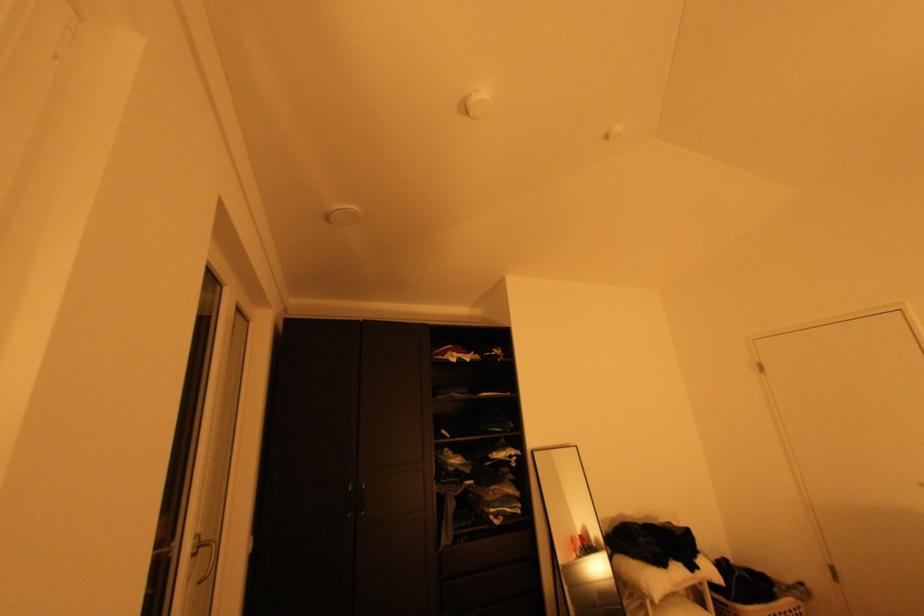
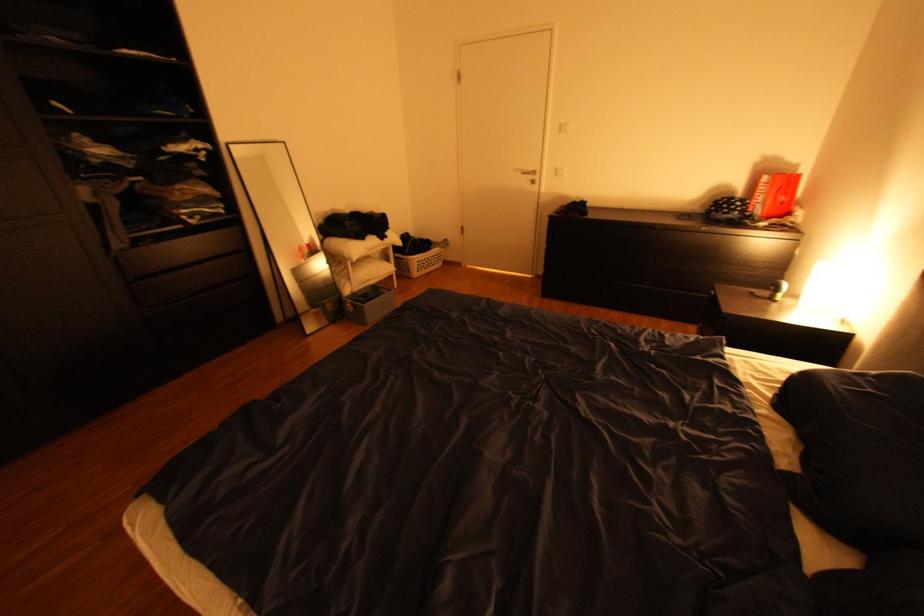
The first image is from the beginning of the video and the second image is from the end. How did the camera likely rotate when shooting the video?

The camera rotated toward right-down.